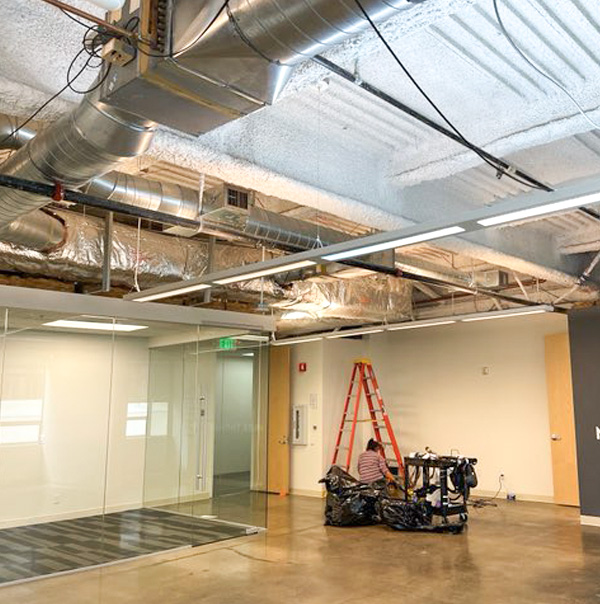
The height and width of the screenshot is (604, 600). I want to click on door, so click(201, 448).